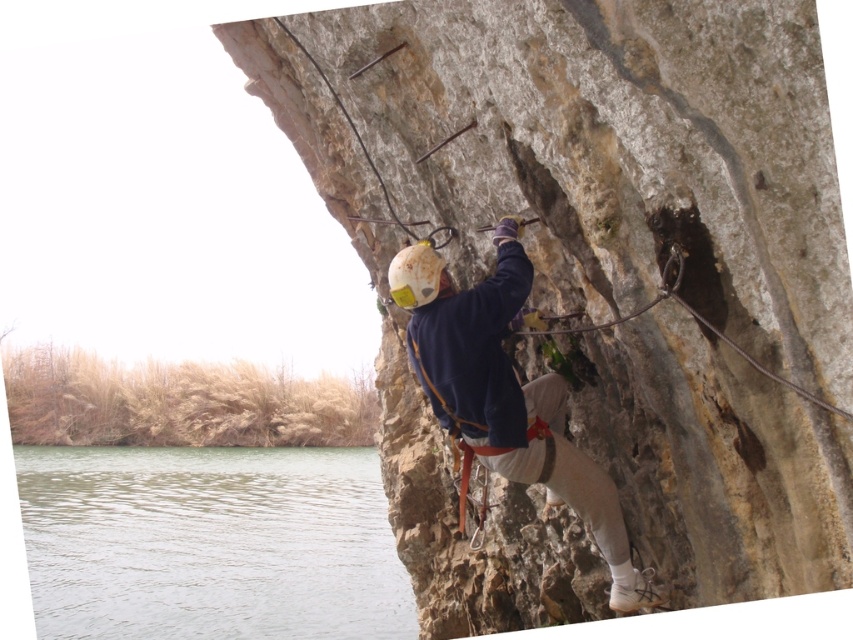
You are a hiker planning to cross the cliff using the metal rungs. You notice the greenish water at lower left and the dark blue fleece jacket at center. Which object is higher up on the cliff?

The dark blue fleece jacket at center is higher up on the cliff because the greenish water at lower left is taller than it, indicating it is positioned lower.

You are a hiker who wants to take a photo of the dark blue fleece jacket at center and the greenish water at lower left. Which object should you zoom in more on to capture both in the frame?

You should zoom in more on the dark blue fleece jacket at center because it is smaller than the greenish water at lower left, allowing both to fit within the frame.

You are a photographer positioned at the base of the cliff. You want to capture a photo of the natural stone rock climber at center and the dark blue fleece jacket at center in the same frame. Based on their positions, which object should you focus on first to ensure both are in the shot?

The natural stone rock climber at center is to the left of the dark blue fleece jacket at center, so you should focus on the natural stone rock climber at center first to ensure both are in the shot.